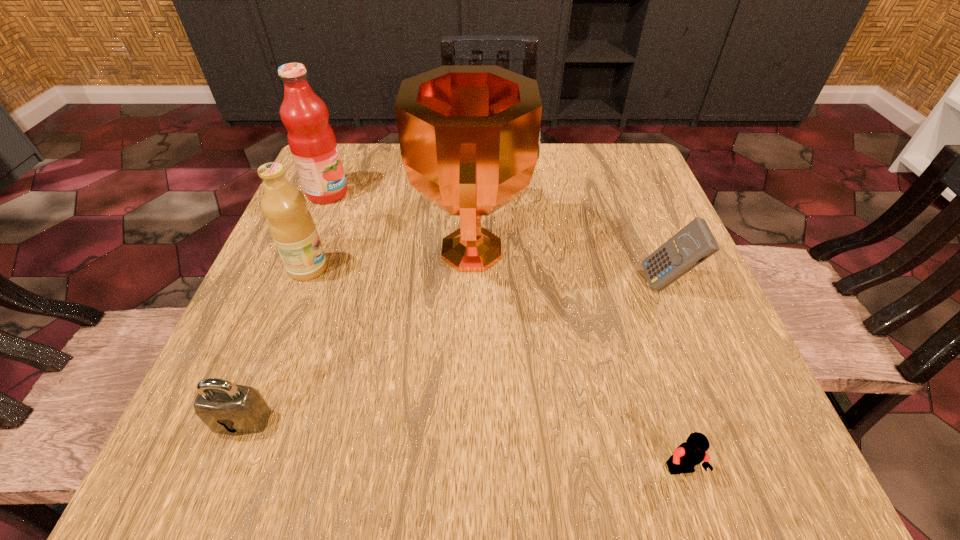
The width and height of the screenshot is (960, 540). Find the location of `vacant area that lies between the third shortest object and the olive oil`. vacant area that lies between the third shortest object and the olive oil is located at coordinates pos(488,276).

Locate an element on the screen. The width and height of the screenshot is (960, 540). object that is the closest one to the fifth object from left to right is located at coordinates (469, 135).

Select which object is the second closest to the second shortest object. Please provide its 2D coordinates. Your answer should be formatted as a tuple, i.e. [(x, y)], where the tuple contains the x and y coordinates of a point satisfying the conditions above.

[(291, 225)]

Find the location of `blank area in the image that satisfies the following two spatial constraints: 1. on the label of the olive oil; 2. at the front of the padlock near the keyhole`. blank area in the image that satisfies the following two spatial constraints: 1. on the label of the olive oil; 2. at the front of the padlock near the keyhole is located at coordinates (250, 420).

You are a GUI agent. You are given a task and a screenshot of the screen. Output one action in this format:
    pyautogui.click(x=<x>, y=<y>)
    Task: Click on the vacant space that satisfies the following two spatial constraints: 1. on the label of the olive oil; 2. at the front of the second nearest object near the keyhole
    
    Given the screenshot: What is the action you would take?
    pyautogui.click(x=250, y=420)